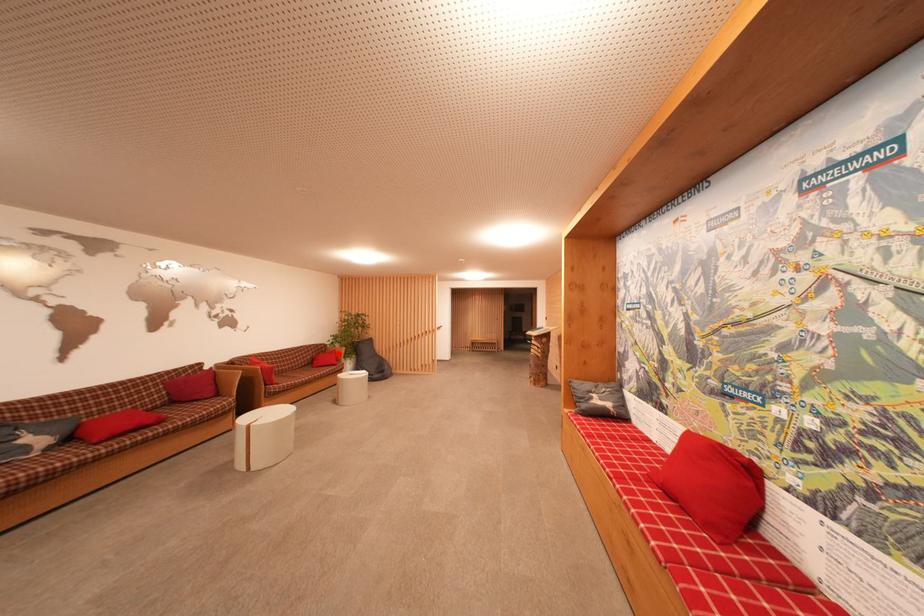
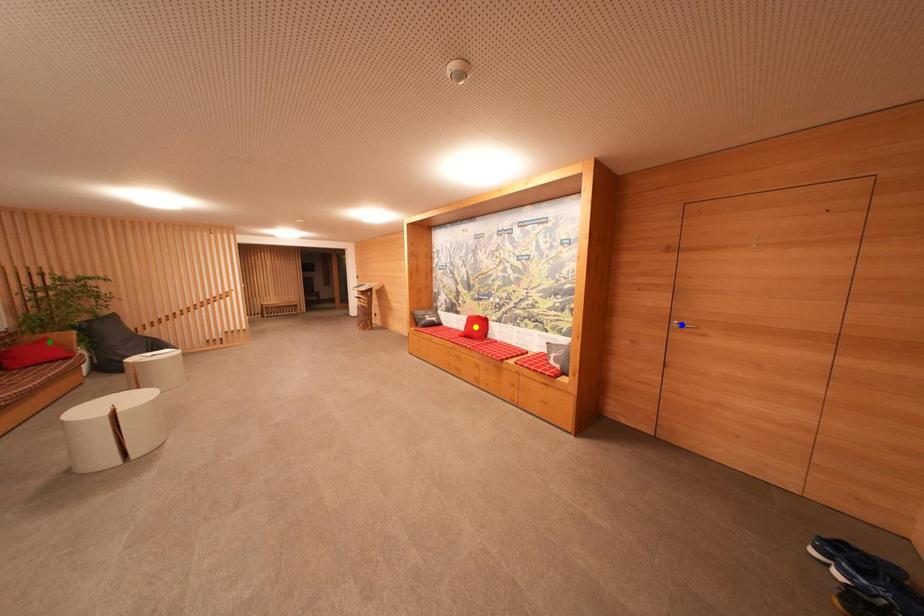
Question: I am providing you with two images of the same scene from different viewpoints. A red point is marked on the first image. You are given multiple points on the second image. In image 2, which mark is for the same physical point as the one in image 1?

Choices:
 (A) yellow point
 (B) green point
 (C) blue point

Answer: (B)